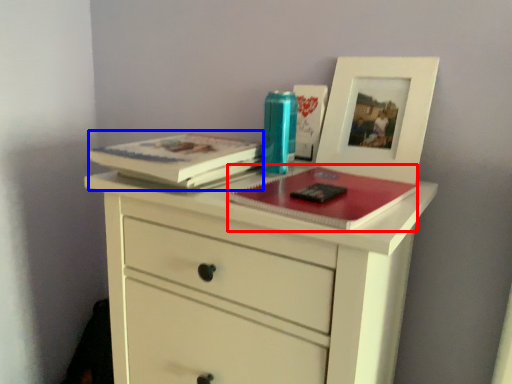
Question: Among these objects, which one is farthest to the camera, magazine (highlighted by a red box) or paperback book (highlighted by a blue box)?

Choices:
 (A) magazine
 (B) paperback book

Answer: (B)